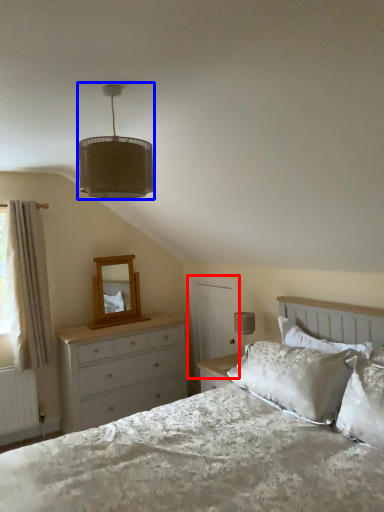
Question: Which of the following is the farthest to the observer, screen door (highlighted by a red box) or lamp (highlighted by a blue box)?

Choices:
 (A) screen door
 (B) lamp

Answer: (A)